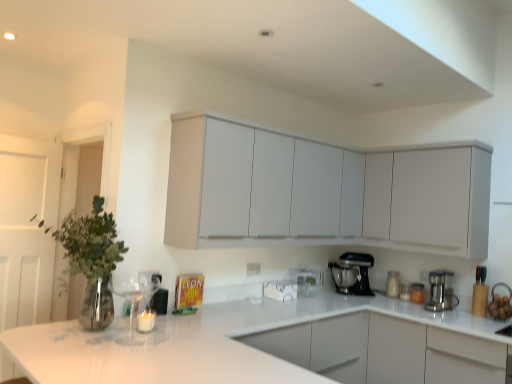
Question: From a real-world perspective, is white wooden door at left above or below white glossy jar at lower right?

Choices:
 (A) below
 (B) above

Answer: (B)

Question: In terms of width, does white wooden door at left look wider or thinner when compared to white glossy jar at lower right?

Choices:
 (A) thin
 (B) wide

Answer: (A)

Question: Which object is positioned farthest from the white matte cabinet at upper right, the 1th cabinetry in the right-to-left sequence?

Choices:
 (A) white glossy sink at lower right
 (B) satin silver coffee maker at right, which appears as the 2th kitchen appliance when viewed from the left
 (C) matte white cabinets at upper center, placed as the 1th cabinetry when sorted from left to right
 (D) white glossy jar at lower right
 (E) black metallic stand mixer at lower center, the second kitchen appliance from the front

Answer: (D)

Question: Estimate the real-world distances between objects in this image. Which object is closer to the white glossy jar at lower right?

Choices:
 (A) matte white cabinets at upper center, placed as the 1th cabinetry when sorted from left to right
 (B) white matte cabinet at upper right, the 1th cabinetry in the right-to-left sequence
 (C) white glossy countertop at center
 (D) white wooden door at left
 (E) black metallic stand mixer at lower center, which ranks as the first kitchen appliance in left-to-right order

Answer: (E)